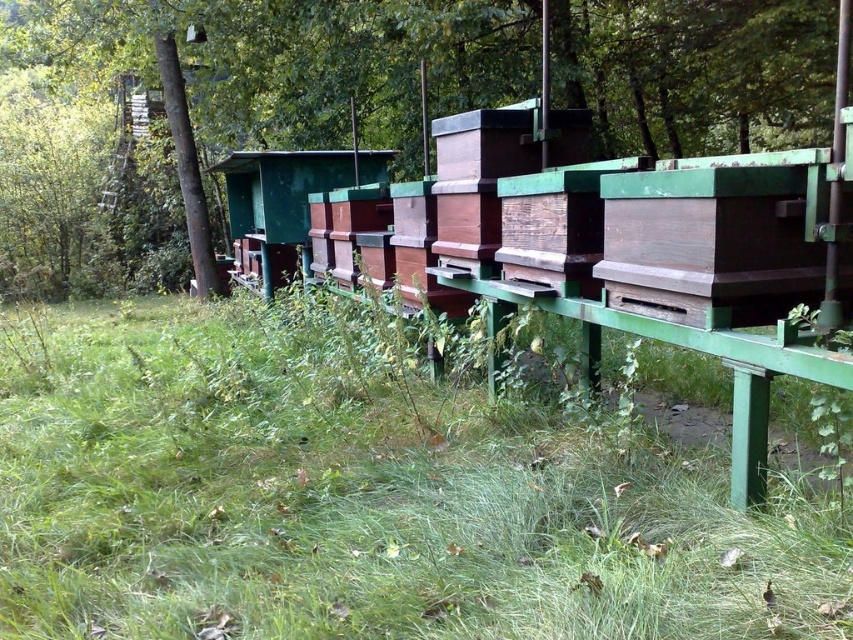
You are a beekeeper looking to place a new beehive. You need to choose between placing it on the green grass at lower center or under the green wood tree at center. Based on the space each area occupies, which location would allow the hive to have more room to grow?

The green wood tree at center occupies more space than the green grass at lower center, so placing the hive under the green wood tree at center would provide more room for growth.

You are standing in front of the beehives and want to reach a point that is exactly 1.72 meters away from you. Can you confirm if the point at coordinates point (366,579) is exactly that distance away?

Yes, the point (366,579) is exactly 1.72 meters away from the viewer, so it meets the requirement.

You are a beekeeper standing in front of the beehives. You notice the green grass at lower center and the green wood tree at center. Which object is closer to you?

The green grass at lower center is closer to you because it is in front of the green wood tree at center.